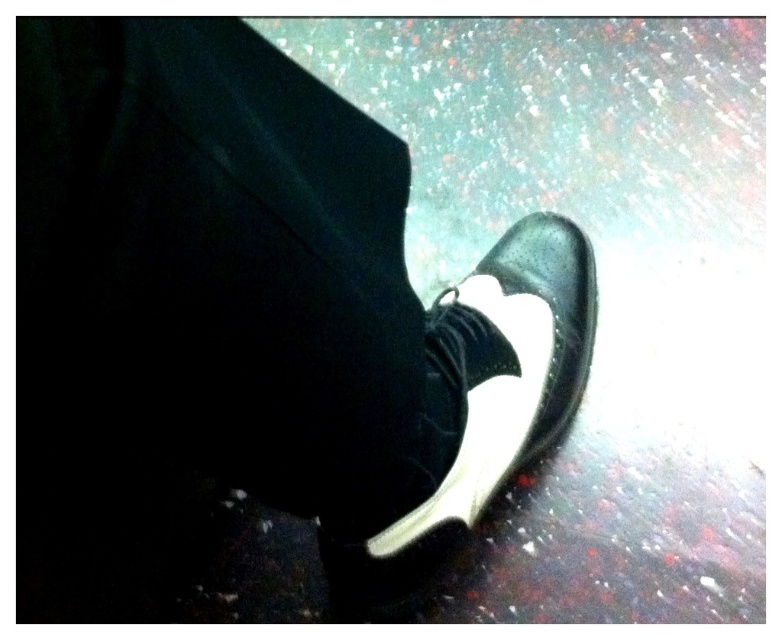
You are a shoemaker trying to place two shoes on a display stand. The display stand has a space that can only accommodate a total distance of 3 inches between the two shoes. Given the black leather shoe at lower right and the matte black shoe at center, can both shoes be placed on the display stand without exceeding the space constraint?

The black leather shoe at lower right is 3.60 inches away from the matte black shoe at center. Since the required space is 3 inches, the distance between them exceeds the limit, so they cannot be placed on the display stand without exceeding the space constraint.

You are a photographer trying to capture a detailed closeup of the shoe. The point at coordinates point (361, 468) is part of the shoe. If your camera is currently positioned 24.26 inches away from this point, is the camera close enough to focus on the shoe?

Result: The point point (361, 468) and camera are 24.26 inches apart from each other. Since the point is part of the shoe, the camera is positioned 24.26 inches away from the shoe. Whether this distance is close enough to focus depends on the camera settings and lens capabilities, but the given information does not specify this. However, based on typical closeup photography requirements, 24.26 inches might be a reasonable distance for focusing on the shoe details.

You are a shoe designer observing the closeup of a person wearing two shoes. You need to determine which shoe is shorter in height between the black leather shoe at lower right and the matte black shoe at center. Which one is shorter?

The black leather shoe at lower right has a lesser height compared to the matte black shoe at center, so the black leather shoe at lower right is shorter in height.